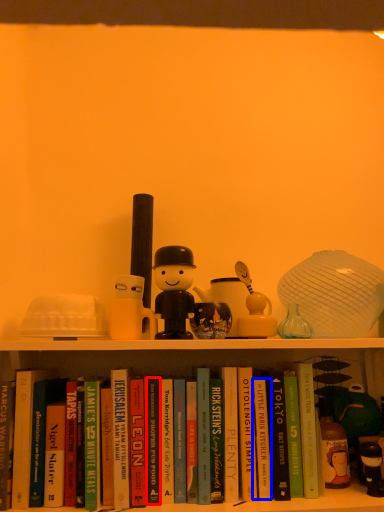
Question: Which object appears farthest to the camera in this image, paperback book (highlighted by a red box) or paperback book (highlighted by a blue box)?

Choices:
 (A) paperback book
 (B) paperback book

Answer: (B)